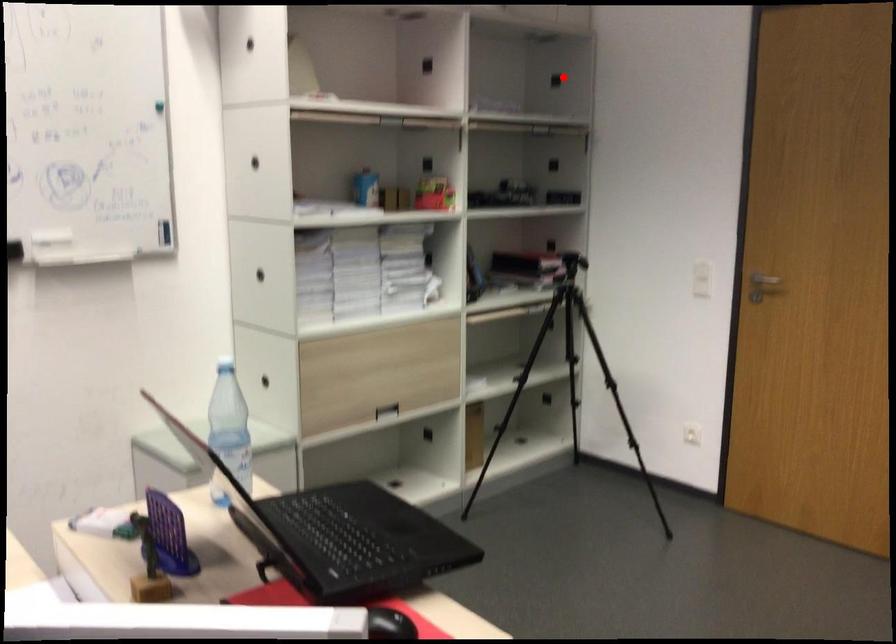
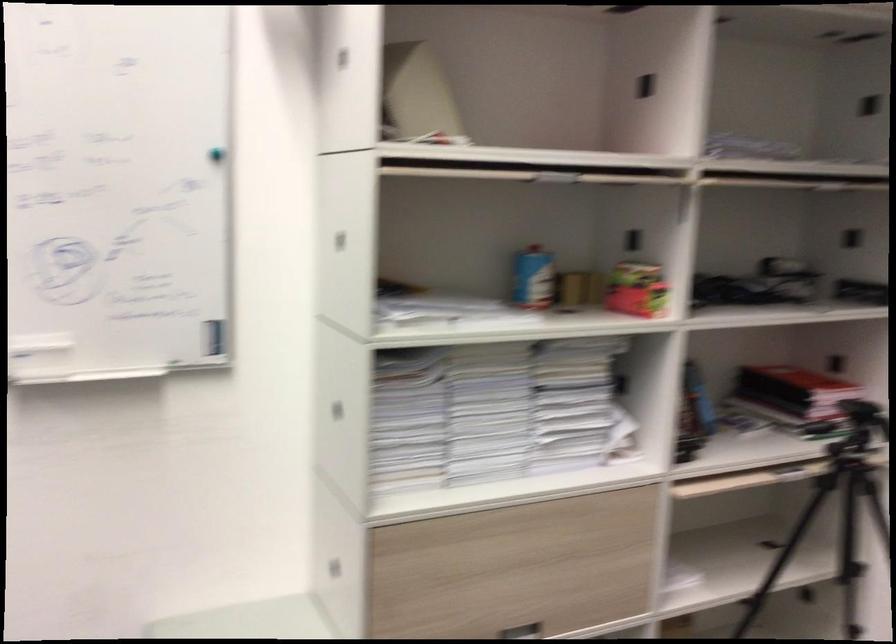
Where in the second image is the point corresponding to the highlighted location from the first image?

(869, 104)